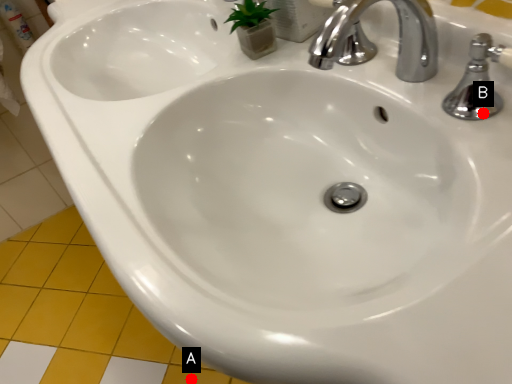
Question: Two points are circled on the image, labeled by A and B beside each circle. Which point appears closest to the camera in this image?

Choices:
 (A) A is closer
 (B) B is closer

Answer: (B)